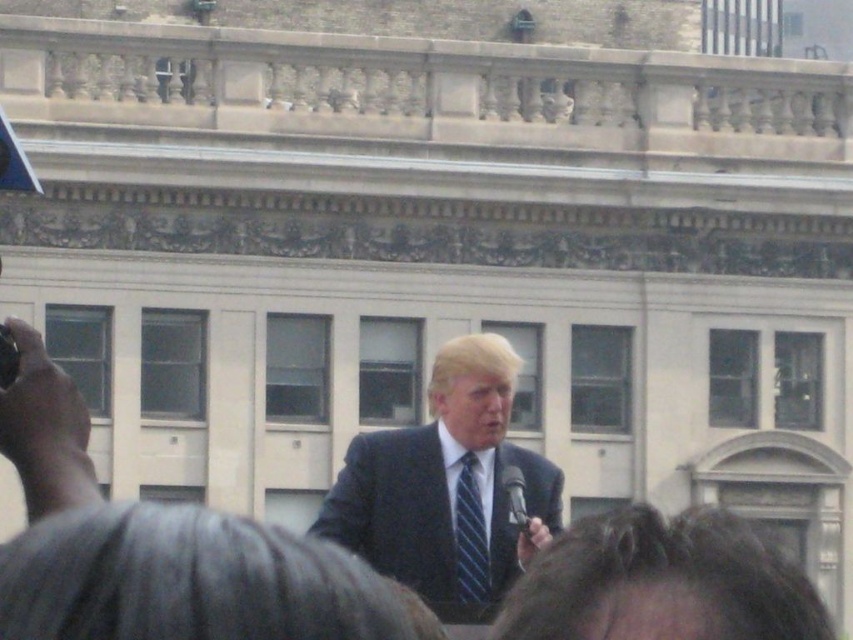
You are a photographer setting up for a group photo at the event. You need to ensure that both the dark blue suit at center and the blue striped tie at center are in focus. Given that your camera has a depth of field that can sharply capture objects within a 2.5 meter range, will both items be in focus?

The dark blue suit at center and the blue striped tie at center are 2.85 meters apart from each other. Since the distance between them exceeds the camera sensor depth of field range of 2.5 meters, both items cannot be in focus simultaneously.

You are a photographer at the event and want to capture a closeup of the speaker. The blue striped tie at center and the black plastic microphone at lower center are both in the frame. Which object is smaller in the photo?

The blue striped tie at center is smaller compared to the black plastic microphone at lower center in the photo.